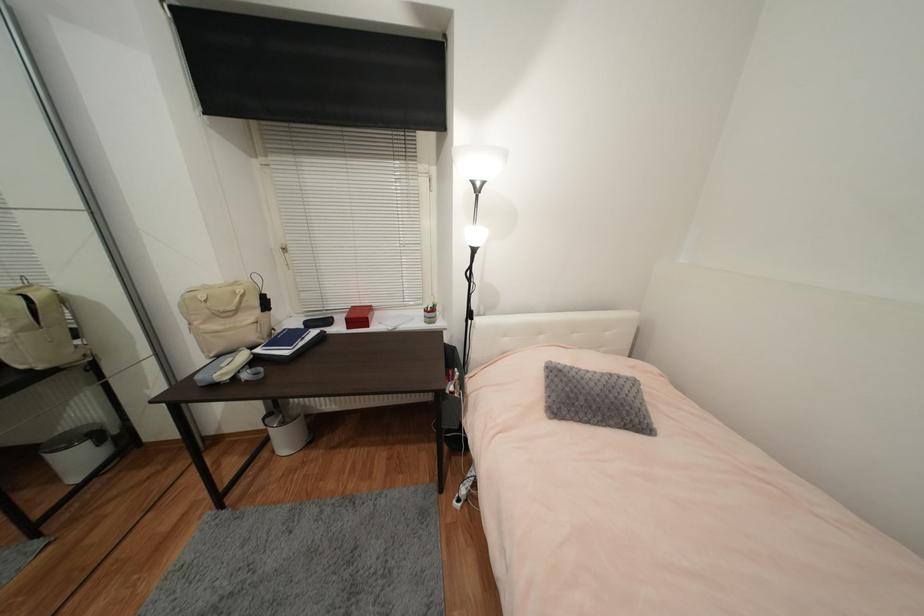
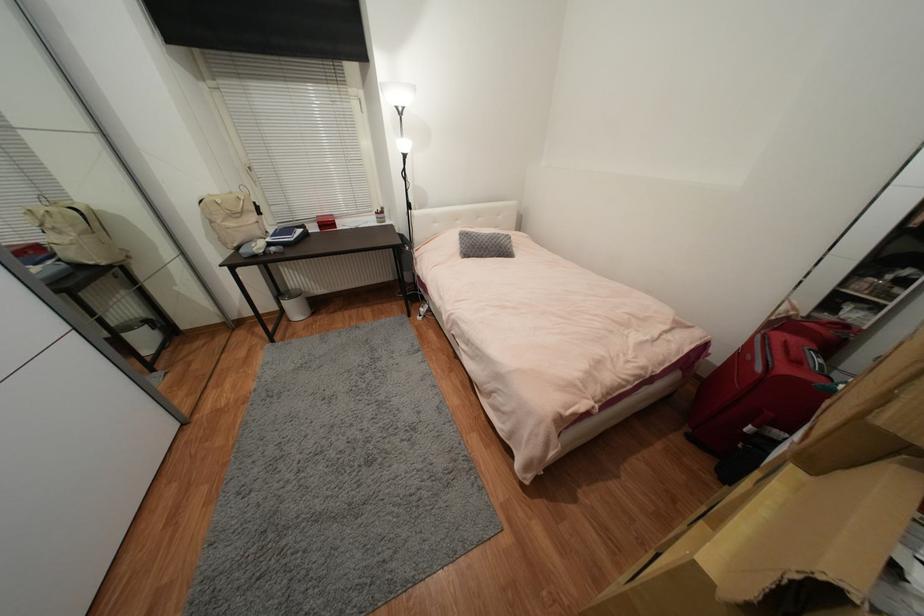
Question: The images are taken continuously from a first-person perspective. In which direction are you moving?

Choices:
 (A) Left
 (B) Right
 (C) Forward
 (D) Backward

Answer: (D)